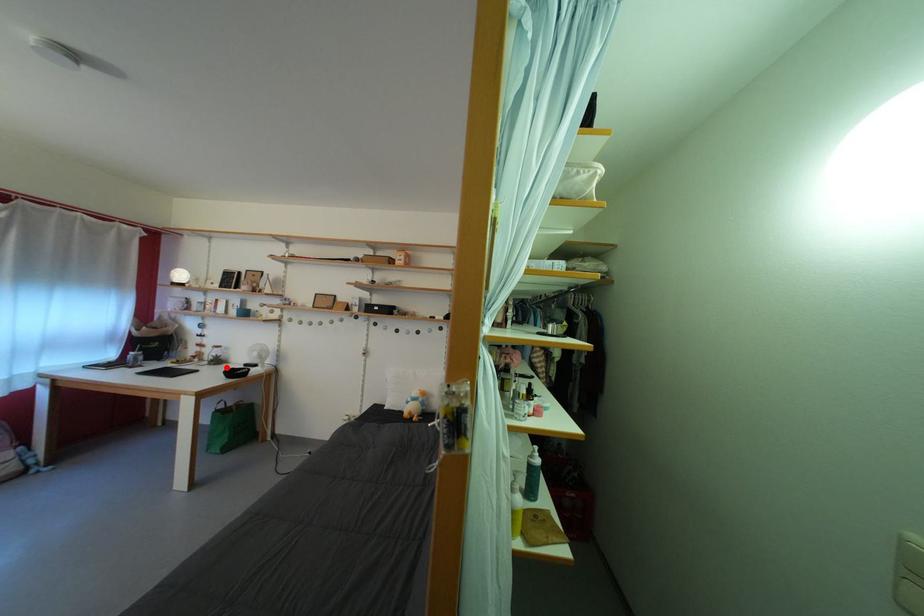
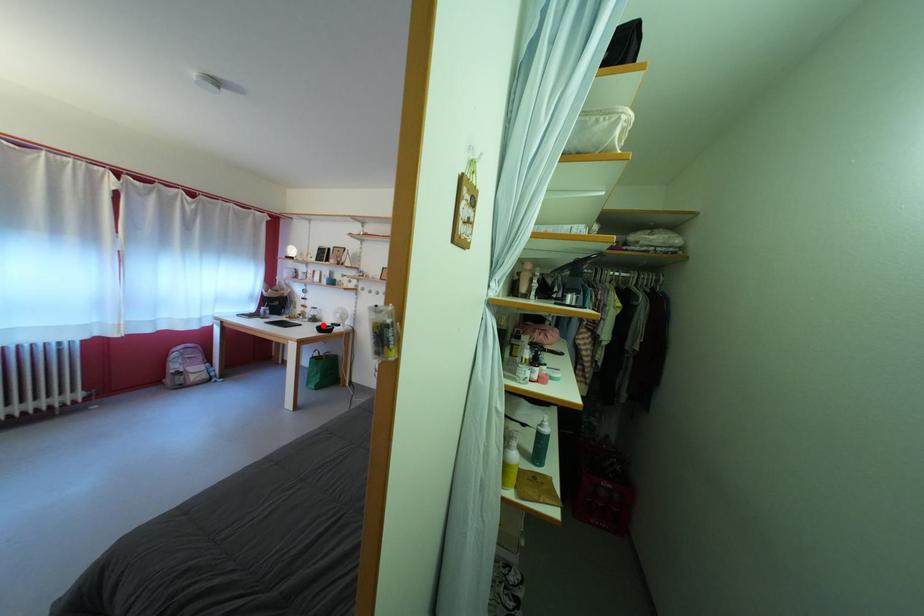
I am providing you with two images of the same scene from different viewpoints. A red point is marked on the first image and another point is marked on the second image. Is the marked point in image1 the same physical position as the marked point in image2?

Yes